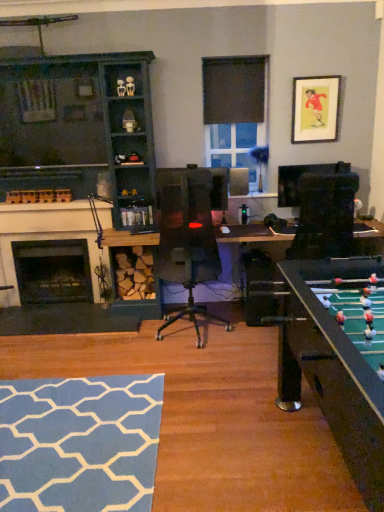
At what (x,y) coordinates should I click in order to perform the action: click on vacant area situated below blue fabric rug at lower left (from a real-world perspective). Please return your answer as a coordinate pair (x, y). The width and height of the screenshot is (384, 512). Looking at the image, I should click on (70, 444).